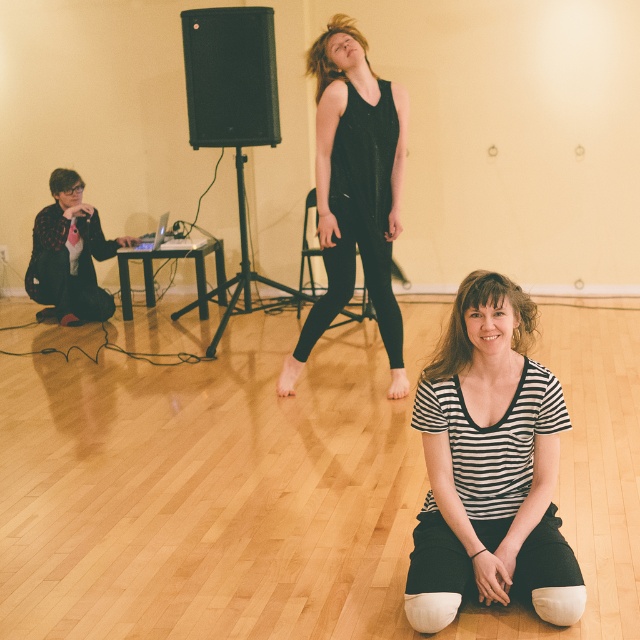
You are trying to decide which shirt to wear for a casual day out. Based on the image, which of the two shirts, the black striped shirt at lower center or the flannel shirt at left, would be more suitable for layering under a jacket?

The flannel shirt at left is thicker than the black striped shirt at lower center, so the flannel shirt at left would be better for layering under a jacket.

You are standing in the dance studio and want to move from the point at coordinates point (362, 246) to the point at coordinates point (83, 294). Which direction should you move to reach your destination?

You should move backward because point (362, 246) is in front of point (83, 294), so to reach the latter, you need to move in the opposite direction.